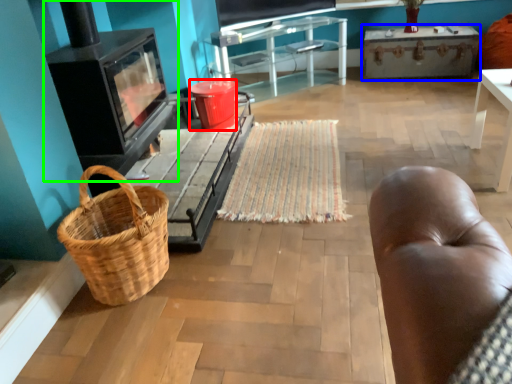
Question: Which object is the closest to the bucket (highlighted by a red box)? Choose among these: table (highlighted by a blue box) or stove (highlighted by a green box).

Choices:
 (A) table
 (B) stove

Answer: (B)